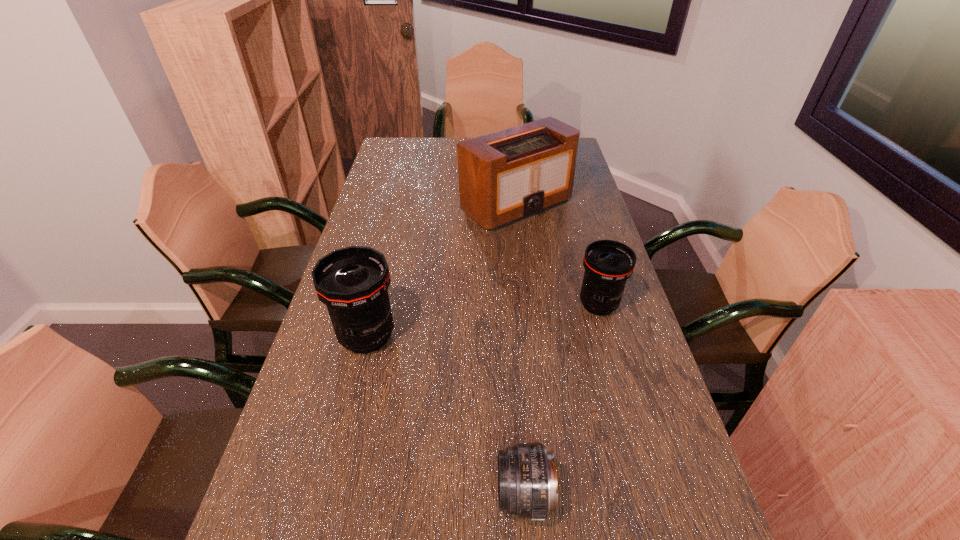
Locate an element on the screen. vacant space located at the front element of the shortest object is located at coordinates (388, 495).

Where is `free point located at the front element of the shortest object`? The height and width of the screenshot is (540, 960). free point located at the front element of the shortest object is located at coordinates (361, 495).

Where is `vacant area situated at the front element of the shortest object`? The height and width of the screenshot is (540, 960). vacant area situated at the front element of the shortest object is located at coordinates (303, 495).

The width and height of the screenshot is (960, 540). Identify the location of object positioned at the left edge. (352, 282).

You are a GUI agent. You are given a task and a screenshot of the screen. Output one action in this format:
    pyautogui.click(x=<x>, y=<y>)
    Task: Click on the radio receiver that is at the right edge
    The height and width of the screenshot is (540, 960).
    Given the screenshot: What is the action you would take?
    pyautogui.click(x=506, y=176)

Locate an element on the screen. This screenshot has width=960, height=540. telephoto lens at the right edge is located at coordinates (608, 264).

In the image, there is a desktop. At what (x,y) coordinates should I click in order to perform the action: click on vacant space at the far edge. Please return your answer as a coordinate pair (x, y). The width and height of the screenshot is (960, 540). Looking at the image, I should click on (437, 140).

At what (x,y) coordinates should I click in order to perform the action: click on free space at the left edge of the desktop. Please return your answer as a coordinate pair (x, y). Looking at the image, I should click on (394, 166).

I want to click on vacant region at the right edge of the desktop, so click(x=583, y=191).

You are a GUI agent. You are given a task and a screenshot of the screen. Output one action in this format:
    pyautogui.click(x=<x>, y=<y>)
    Task: Click on the free region at the far left corner
    The height and width of the screenshot is (540, 960).
    Given the screenshot: What is the action you would take?
    pyautogui.click(x=418, y=140)